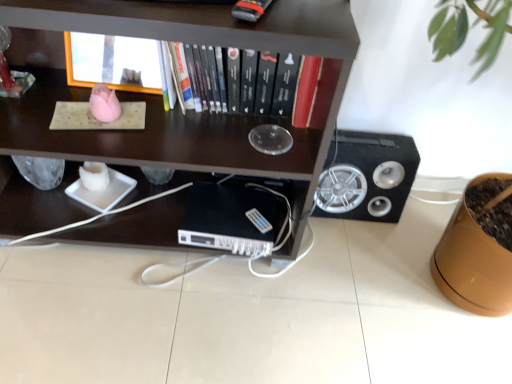
Question: From a real-world perspective, is black plastic computer at center beneath wooden frame at upper center, which appears as the second shelf when ordered from the bottom?

Choices:
 (A) yes
 (B) no

Answer: (A)

Question: Is wooden frame at upper center, the first shelf viewed from the top, completely or partially inside black plastic computer at center?

Choices:
 (A) no
 (B) yes

Answer: (A)

Question: Considering the relative sizes of black plastic computer at center and wooden frame at upper center, which appears as the second shelf when ordered from the bottom, in the image provided, is black plastic computer at center thinner than wooden frame at upper center, which appears as the second shelf when ordered from the bottom,?

Choices:
 (A) no
 (B) yes

Answer: (A)

Question: Is black plastic computer at center positioned with its back to wooden frame at upper center, the first shelf viewed from the top?

Choices:
 (A) no
 (B) yes

Answer: (A)

Question: Could you tell me if black plastic computer at center is turned towards wooden frame at upper center, the first shelf viewed from the top?

Choices:
 (A) yes
 (B) no

Answer: (B)

Question: Is black plastic computer at center to the left of wooden frame at upper center, which appears as the second shelf when ordered from the bottom, from the viewer's perspective?

Choices:
 (A) yes
 (B) no

Answer: (B)

Question: Does wooden frame at upper center, the first shelf viewed from the top, come behind dark wood shelf at upper center, arranged as the 2th shelf when viewed from the top?

Choices:
 (A) yes
 (B) no

Answer: (A)

Question: Is wooden frame at upper center, which appears as the second shelf when ordered from the bottom, closer to camera compared to dark wood shelf at upper center, arranged as the 2th shelf when viewed from the top?

Choices:
 (A) no
 (B) yes

Answer: (A)

Question: Is dark wood shelf at upper center, arranged as the 1th shelf when ordered from the bottom, at the back of wooden frame at upper center, which appears as the second shelf when ordered from the bottom?

Choices:
 (A) no
 (B) yes

Answer: (B)

Question: Does wooden frame at upper center, which appears as the second shelf when ordered from the bottom, appear on the left side of dark wood shelf at upper center, arranged as the 1th shelf when ordered from the bottom?

Choices:
 (A) no
 (B) yes

Answer: (B)

Question: Does wooden frame at upper center, which appears as the second shelf when ordered from the bottom, have a lesser height compared to dark wood shelf at upper center, arranged as the 2th shelf when viewed from the top?

Choices:
 (A) yes
 (B) no

Answer: (A)

Question: Could you tell me if wooden frame at upper center, which appears as the second shelf when ordered from the bottom, is turned towards dark wood shelf at upper center, arranged as the 1th shelf when ordered from the bottom?

Choices:
 (A) yes
 (B) no

Answer: (A)

Question: Can you confirm if black matte speaker at right is positioned to the left of hardcover book at center?

Choices:
 (A) yes
 (B) no

Answer: (B)